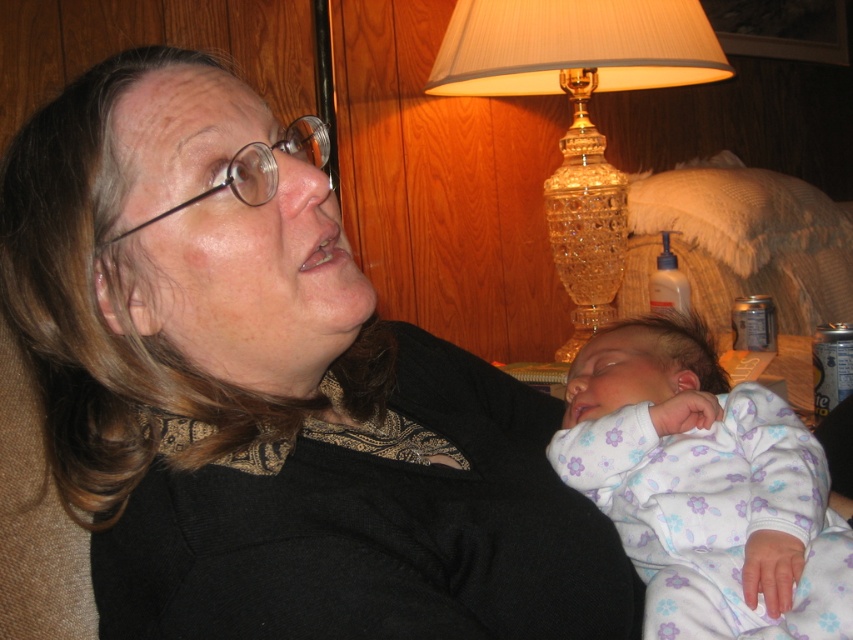
You are an interior designer assessing the placement of the floral cotton onesie at lower right and the crystal glass lamp at upper right. Which object is shorter?

The floral cotton onesie at lower right is not as tall as the crystal glass lamp at upper right, so the floral cotton onesie at lower right is shorter.

You are a photographer trying to capture the scene where the older woman and baby are positioned. You need to ensure the focus is on the matte black sweater at center. Given that the camera can only focus on objects within a radius of 0.1 units from the point you select, would the sweater be in focus if you choose the point at coordinates point (268, 394)?

The point (268, 394) marks the matte black sweater at center. Since the focus radius is 0.1 units from the selected point, the sweater is exactly at the chosen coordinates, so it will be in focus.